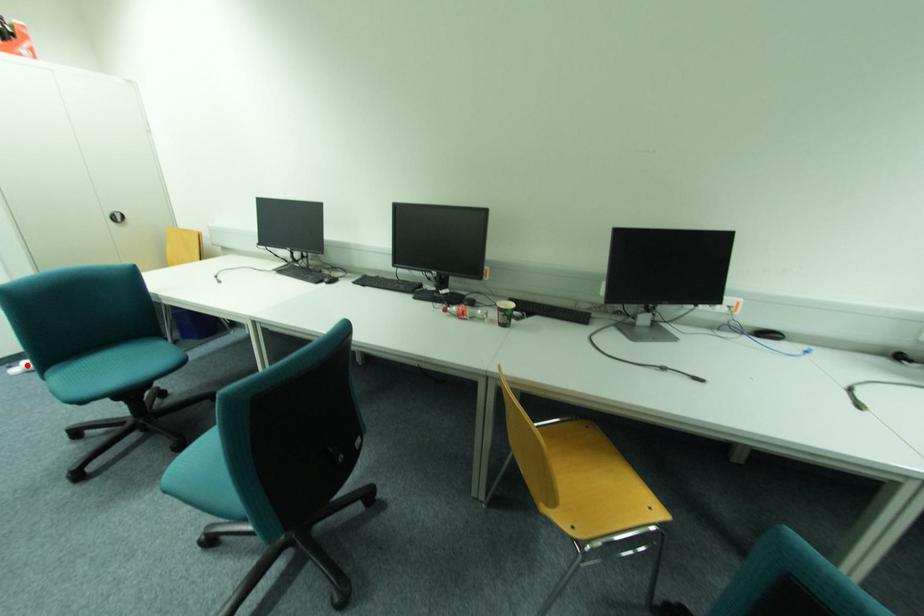
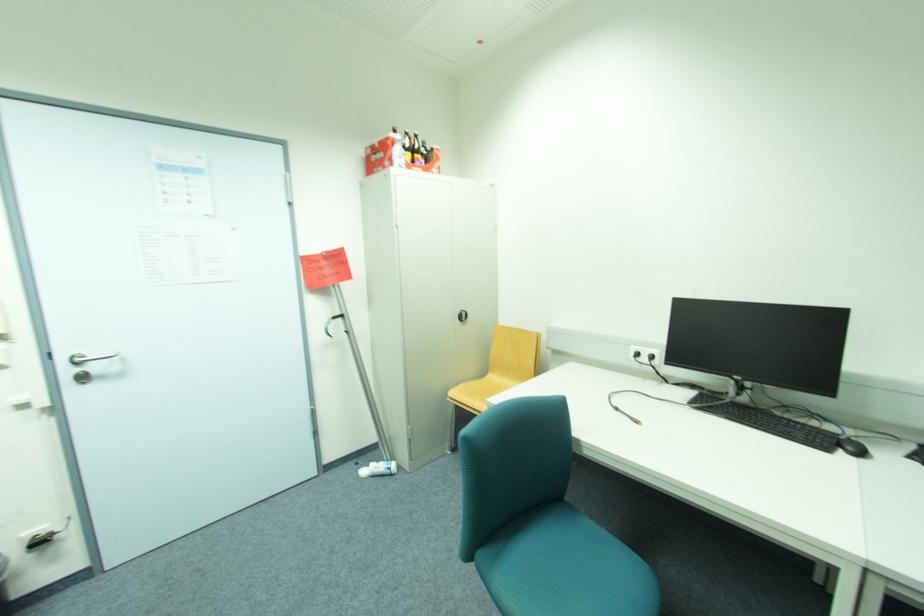
Find the pixel in the second image that matches the highlighted location in the first image.

(373, 468)